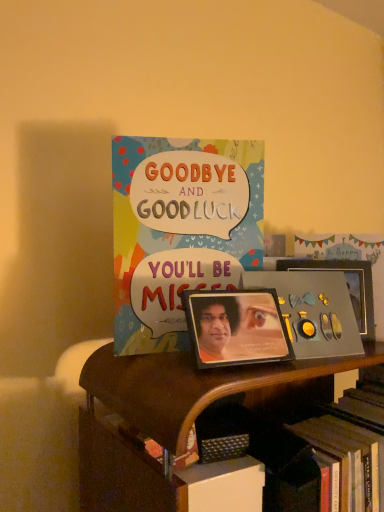
Question: Is metallic photo frame at center, arranged as the first picture frame when viewed from the left, thinner than wooden bookcase at center?

Choices:
 (A) no
 (B) yes

Answer: (B)

Question: Does metallic photo frame at center, which is the 1th picture frame in front-to-back order, have a smaller size compared to wooden bookcase at center?

Choices:
 (A) yes
 (B) no

Answer: (A)

Question: From a real-world perspective, is metallic photo frame at center, the second picture frame in the right-to-left sequence, physically below wooden bookcase at center?

Choices:
 (A) yes
 (B) no

Answer: (B)

Question: Can you confirm if metallic photo frame at center, the second picture frame in the right-to-left sequence, is positioned to the left of wooden bookcase at center?

Choices:
 (A) yes
 (B) no

Answer: (A)

Question: Could wooden bookcase at center be considered to be inside metallic photo frame at center, the second picture frame in the right-to-left sequence?

Choices:
 (A) no
 (B) yes

Answer: (A)

Question: Is wooden bookcase at center in front of or behind colorful paper card at upper center in the image?

Choices:
 (A) behind
 (B) front

Answer: (B)

Question: In terms of width, does wooden bookcase at center look wider or thinner when compared to colorful paper card at upper center?

Choices:
 (A) thin
 (B) wide

Answer: (B)

Question: Considering the positions of wooden bookcase at center and colorful paper card at upper center in the image, is wooden bookcase at center bigger or smaller than colorful paper card at upper center?

Choices:
 (A) small
 (B) big

Answer: (B)

Question: Considering the positions of wooden bookcase at center and colorful paper card at upper center in the image, is wooden bookcase at center taller or shorter than colorful paper card at upper center?

Choices:
 (A) tall
 (B) short

Answer: (A)

Question: Considering their positions, is metallic silver album cover at center located in front of or behind metallic photo frame at center, the 2th picture frame when ordered from back to front?

Choices:
 (A) front
 (B) behind

Answer: (B)

Question: From the image's perspective, relative to metallic photo frame at center, arranged as the first picture frame when viewed from the left, is metallic silver album cover at center above or below?

Choices:
 (A) below
 (B) above

Answer: (B)

Question: In terms of height, does metallic silver album cover at center look taller or shorter compared to metallic photo frame at center, the 2th picture frame when ordered from back to front?

Choices:
 (A) short
 (B) tall

Answer: (B)

Question: Considering the relative positions of metallic silver album cover at center and metallic photo frame at center, the second picture frame in the right-to-left sequence, in the image provided, is metallic silver album cover at center to the left or to the right of metallic photo frame at center, the second picture frame in the right-to-left sequence,?

Choices:
 (A) right
 (B) left

Answer: (A)

Question: Is metallic photo frame at center, which is the 1th picture frame in front-to-back order, taller or shorter than wooden bookcase at center?

Choices:
 (A) tall
 (B) short

Answer: (B)

Question: From a real-world perspective, is metallic photo frame at center, the second picture frame in the right-to-left sequence, positioned above or below wooden bookcase at center?

Choices:
 (A) above
 (B) below

Answer: (A)